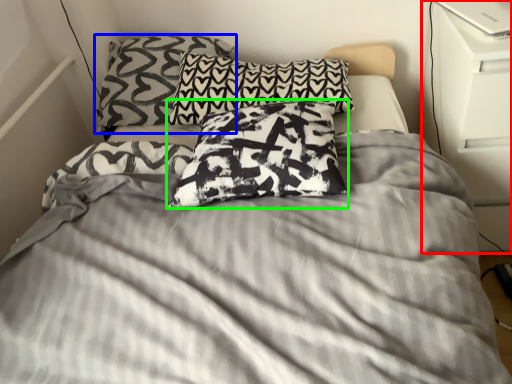
Question: Estimate the real-world distances between objects in this image. Which object is closer to dresser (highlighted by a red box), pillow (highlighted by a blue box) or pillow (highlighted by a green box)?

Choices:
 (A) pillow
 (B) pillow

Answer: (B)